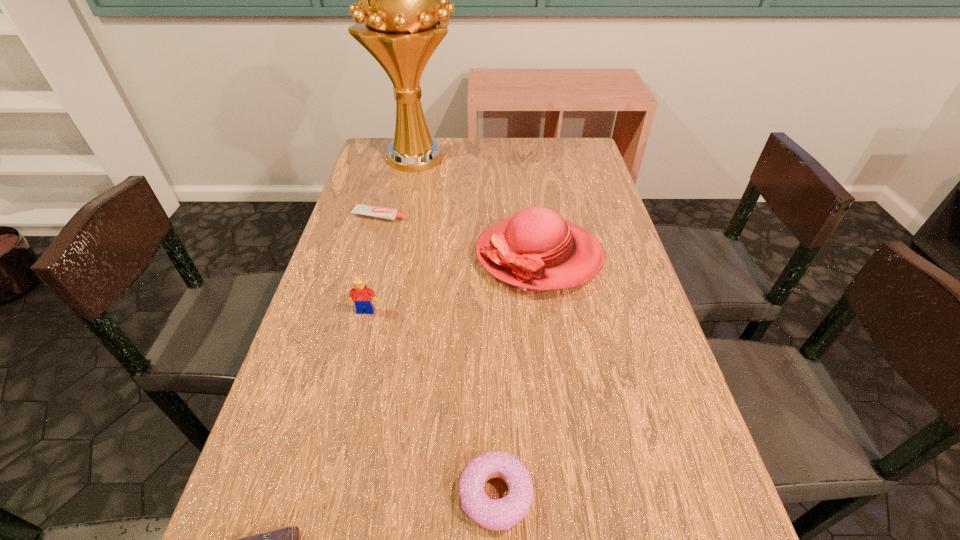
You are a GUI agent. You are given a task and a screenshot of the screen. Output one action in this format:
    pyautogui.click(x=<x>, y=<y>)
    Task: Click on the vacant space at the far edge of the desktop
    
    Given the screenshot: What is the action you would take?
    pyautogui.click(x=452, y=139)

In the image, there is a desktop. Where is `vacant region at the left edge`? This screenshot has height=540, width=960. vacant region at the left edge is located at coordinates (371, 205).

In the image, there is a desktop. Where is `vacant space at the right edge`? This screenshot has height=540, width=960. vacant space at the right edge is located at coordinates (696, 470).

This screenshot has height=540, width=960. In the image, there is a desktop. Find the location of `vacant region at the far left corner`. vacant region at the far left corner is located at coordinates tap(376, 158).

The width and height of the screenshot is (960, 540). In order to click on unoccupied area between the fifth shortest object and the fourth shortest object in this screenshot , I will do `click(452, 284)`.

I want to click on blank region between the fourth shortest object and the second tallest object, so click(452, 284).

The height and width of the screenshot is (540, 960). I want to click on free space between the tallest object and the fourth tallest object, so click(458, 326).

You are a GUI agent. You are given a task and a screenshot of the screen. Output one action in this format:
    pyautogui.click(x=<x>, y=<y>)
    Task: Click on the free spot between the third nearest object and the tallest object
    
    Given the screenshot: What is the action you would take?
    pyautogui.click(x=392, y=234)

At what (x,y) coordinates should I click in order to perform the action: click on blank region between the third nearest object and the hat. Please return your answer as a coordinate pair (x, y). Looking at the image, I should click on tap(452, 284).

Locate an element on the screen. Image resolution: width=960 pixels, height=540 pixels. free space between the fifth shortest object and the tallest object is located at coordinates (478, 206).